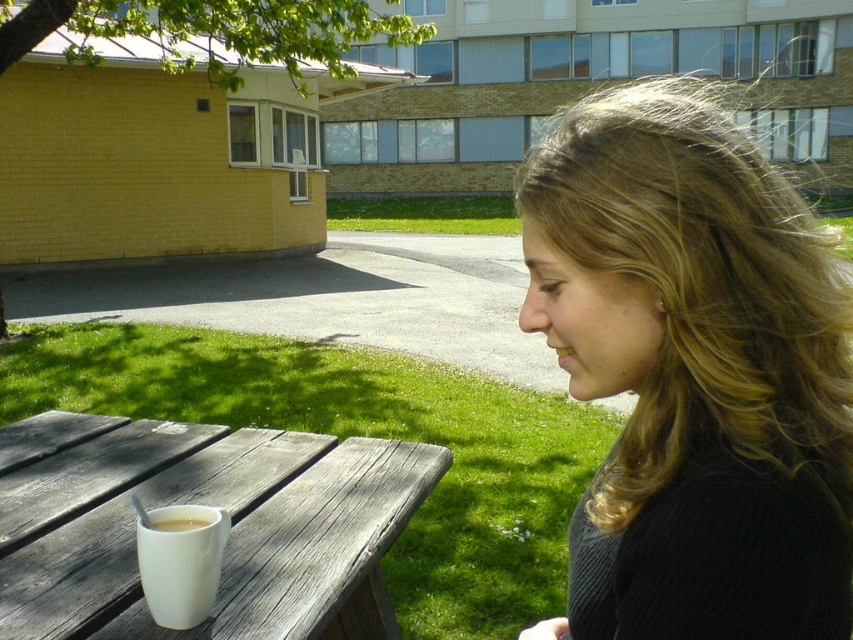
Question: Estimate the real-world distances between objects in this image. Which object is closer to the white matte mug at table left?

Choices:
 (A) white wood table at lower left
 (B) white ceramic mug at lower left
 (C) dark brown hair at right

Answer: (B)

Question: Among these points, which one is farthest from the camera?

Choices:
 (A) (175, 528)
 (B) (637, 339)
 (C) (225, 472)
 (D) (175, 627)

Answer: (C)

Question: Where is dark brown hair at right located in relation to white matte mug at table left in the image?

Choices:
 (A) above
 (B) below

Answer: (A)

Question: Does white wood table at lower left appear on the right side of white matte mug at table left?

Choices:
 (A) no
 (B) yes

Answer: (A)

Question: Does dark brown hair at right appear under white matte mug at table left?

Choices:
 (A) no
 (B) yes

Answer: (A)

Question: Which object is closer to the camera taking this photo?

Choices:
 (A) white ceramic mug at lower left
 (B) white matte mug at table left
 (C) white wood table at lower left
 (D) dark brown hair at right

Answer: (D)